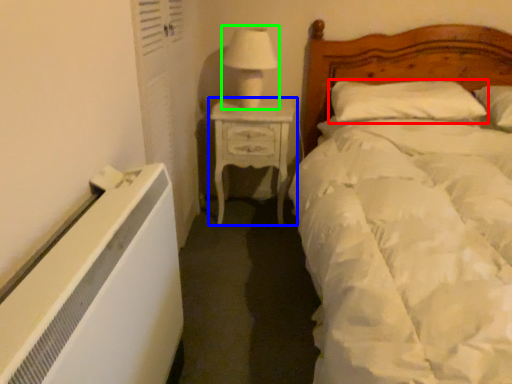
Question: Which is farther away from pillow (highlighted by a red box)? nightstand (highlighted by a blue box) or table lamp (highlighted by a green box)?

Choices:
 (A) nightstand
 (B) table lamp

Answer: (B)